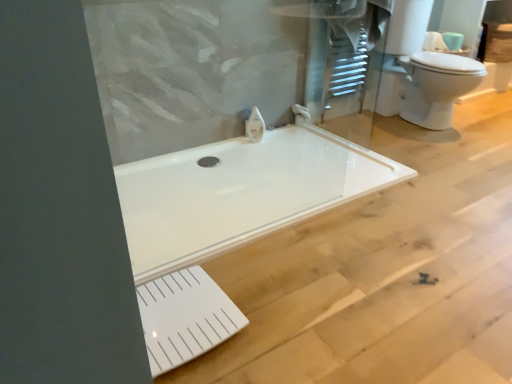
What do you see at coordinates (422, 71) in the screenshot?
I see `white glossy toilet at upper right` at bounding box center [422, 71].

This screenshot has height=384, width=512. What do you see at coordinates (301, 111) in the screenshot?
I see `white glossy faucet at upper center, which ranks as the 1th faucet in right-to-left order` at bounding box center [301, 111].

Identify the location of white glossy toilet at upper right. This screenshot has width=512, height=384. (422, 71).

In the image, is white matte toilet paper at upper right on the left side or the right side of white glossy faucet at upper center, which ranks as the 2th faucet in right-to-left order?

Based on their positions, white matte toilet paper at upper right is located to the right of white glossy faucet at upper center, which ranks as the 2th faucet in right-to-left order.

From a real-world perspective, is white matte toilet paper at upper right positioned over white glossy faucet at upper center, which ranks as the 2th faucet in right-to-left order, based on gravity?

Yes, from a real-world perspective, white matte toilet paper at upper right is over white glossy faucet at upper center, which ranks as the 2th faucet in right-to-left order

From the image's perspective, is white matte toilet paper at upper right beneath white glossy faucet at upper center, the first faucet in the left-to-right sequence?

Incorrect, from the image's perspective, white matte toilet paper at upper right is higher than white glossy faucet at upper center, the first faucet in the left-to-right sequence.

From a real-world perspective, relative to white glossy toilet at upper right, is white glossy faucet at upper center, the 2th faucet viewed from the front, vertically above or below?

white glossy faucet at upper center, the 2th faucet viewed from the front, is below white glossy toilet at upper right.

Is white glossy faucet at upper center, which ranks as the 1th faucet in right-to-left order, far away from white glossy toilet at upper right?

That's not correct — white glossy faucet at upper center, which ranks as the 1th faucet in right-to-left order, is a little close to white glossy toilet at upper right.

Between white glossy faucet at upper center, the second faucet viewed from the left, and white glossy toilet at upper right, which one has larger size?

white glossy toilet at upper right is bigger.

Is white glossy faucet at upper center, the 2th faucet viewed from the front, positioned in front of white glossy toilet at upper right?

That is False.

Which is more to the right, white glossy faucet at upper center, which ranks as the 2th faucet in right-to-left order, or white glossy faucet at upper center, arranged as the first faucet when viewed from the back?

white glossy faucet at upper center, arranged as the first faucet when viewed from the back, is more to the right.

From a real-world perspective, is white glossy faucet at upper center, which is the first faucet in front-to-back order, physically above white glossy faucet at upper center, arranged as the first faucet when viewed from the back?

Yes, from a real-world perspective, white glossy faucet at upper center, which is the first faucet in front-to-back order, is over white glossy faucet at upper center, arranged as the first faucet when viewed from the back

Who is smaller, white glossy faucet at upper center, the second faucet viewed from the left, or white matte toilet paper at upper right?

Smaller between the two is white glossy faucet at upper center, the second faucet viewed from the left.

Consider the image. Is white matte toilet paper at upper right a part of white glossy faucet at upper center, which ranks as the 1th faucet in right-to-left order?

No.

Between white glossy faucet at upper center, the second faucet viewed from the left, and white matte toilet paper at upper right, which one appears on the left side from the viewer's perspective?

white glossy faucet at upper center, the second faucet viewed from the left, is more to the left.

Is white glossy faucet at upper center, which ranks as the 1th faucet in right-to-left order, beside white matte toilet paper at upper right?

No.

From a real-world perspective, is white glossy faucet at upper center, which ranks as the 1th faucet in right-to-left order, under white glossy faucet at upper center, the first faucet in the left-to-right sequence?

Correct, in the physical world, white glossy faucet at upper center, which ranks as the 1th faucet in right-to-left order, is lower than white glossy faucet at upper center, the first faucet in the left-to-right sequence.

Is white glossy faucet at upper center, the second faucet viewed from the left, aimed at white glossy faucet at upper center, the first faucet in the left-to-right sequence?

No.

From the image's perspective, is white glossy faucet at upper center, which ranks as the 1th faucet in right-to-left order, located above white glossy faucet at upper center, which is the first faucet in front-to-back order?

Indeed, from the image's perspective, white glossy faucet at upper center, which ranks as the 1th faucet in right-to-left order, is shown above white glossy faucet at upper center, which is the first faucet in front-to-back order.

Looking at the image, does white glossy faucet at upper center, the 2th faucet viewed from the front, seem bigger or smaller compared to white glossy faucet at upper center, positioned as the second faucet in back-to-front order?

Clearly, white glossy faucet at upper center, the 2th faucet viewed from the front, is larger in size than white glossy faucet at upper center, positioned as the second faucet in back-to-front order.

Which of these two, white glossy faucet at upper center, which ranks as the 2th faucet in right-to-left order, or white glossy toilet at upper right, is thinner?

With smaller width is white glossy faucet at upper center, which ranks as the 2th faucet in right-to-left order.

Is white glossy faucet at upper center, the first faucet in the left-to-right sequence, turned away from white glossy toilet at upper right?

No, white glossy faucet at upper center, the first faucet in the left-to-right sequence, is not facing the opposite direction of white glossy toilet at upper right.

Is white glossy faucet at upper center, which ranks as the 2th faucet in right-to-left order, inside the boundaries of white glossy toilet at upper right, or outside?

white glossy faucet at upper center, which ranks as the 2th faucet in right-to-left order, is outside white glossy toilet at upper right.

Where is `sink above the white glossy faucet at upper center, the first faucet in the left-to-right sequence (from a real-world perspective)`? The image size is (512, 384). sink above the white glossy faucet at upper center, the first faucet in the left-to-right sequence (from a real-world perspective) is located at coordinates (422, 71).

Considering the positions of objects white matte toilet paper at upper right and white glossy faucet at upper center, the 2th faucet viewed from the front, in the image provided, who is behind, white matte toilet paper at upper right or white glossy faucet at upper center, the 2th faucet viewed from the front,?

white matte toilet paper at upper right is further from the camera.

Considering the positions of objects white matte toilet paper at upper right and white glossy faucet at upper center, the 2th faucet viewed from the front, in the image provided, who is more to the left, white matte toilet paper at upper right or white glossy faucet at upper center, the 2th faucet viewed from the front,?

Positioned to the left is white glossy faucet at upper center, the 2th faucet viewed from the front.

Does point (452, 44) lie in front of point (294, 108)?

That is False.

Would you say white matte toilet paper at upper right is outside white glossy faucet at upper center, the second faucet viewed from the left?

Yes.

Where is `toilet paper above the white glossy faucet at upper center, the first faucet in the left-to-right sequence (from a real-world perspective)`? toilet paper above the white glossy faucet at upper center, the first faucet in the left-to-right sequence (from a real-world perspective) is located at coordinates (453, 40).

In order to click on the 2nd faucet directly beneath the white glossy toilet at upper right (from a real-world perspective) in this screenshot , I will do `click(301, 111)`.

Based on the photo, looking at the image, which one is located closer to white glossy faucet at upper center, positioned as the second faucet in back-to-front order, white glossy toilet at upper right or white matte toilet paper at upper right?

white glossy toilet at upper right lies closer to white glossy faucet at upper center, positioned as the second faucet in back-to-front order, than the other object.

Estimate the real-world distances between objects in this image. Which object is closer to white glossy faucet at upper center, arranged as the first faucet when viewed from the back, white glossy faucet at upper center, which is the first faucet in front-to-back order, or white matte toilet paper at upper right?

white glossy faucet at upper center, which is the first faucet in front-to-back order.

Which object lies nearer to the anchor point white matte toilet paper at upper right, white glossy faucet at upper center, which ranks as the 1th faucet in right-to-left order, or white glossy faucet at upper center, which is the first faucet in front-to-back order?

The object closer to white matte toilet paper at upper right is white glossy faucet at upper center, which ranks as the 1th faucet in right-to-left order.

When comparing their distances from white glossy faucet at upper center, the second faucet viewed from the left, does white matte toilet paper at upper right or white glossy toilet at upper right seem further?

The object further to white glossy faucet at upper center, the second faucet viewed from the left, is white matte toilet paper at upper right.

Looking at the image, which one is located closer to white glossy faucet at upper center, positioned as the second faucet in back-to-front order, white matte toilet paper at upper right or white glossy faucet at upper center, the second faucet viewed from the left?

white glossy faucet at upper center, the second faucet viewed from the left.

Based on their spatial positions, is white glossy toilet at upper right or white glossy faucet at upper center, which is the first faucet in front-to-back order, further from white matte toilet paper at upper right?

white glossy faucet at upper center, which is the first faucet in front-to-back order, is further to white matte toilet paper at upper right.

Looking at the image, which one is located closer to white glossy toilet at upper right, white glossy faucet at upper center, arranged as the first faucet when viewed from the back, or white matte toilet paper at upper right?

Based on the image, white matte toilet paper at upper right appears to be nearer to white glossy toilet at upper right.

When comparing their distances from white matte toilet paper at upper right, does white glossy toilet at upper right or white glossy faucet at upper center, the second faucet viewed from the left, seem further?

white glossy faucet at upper center, the second faucet viewed from the left, is positioned further to the anchor white matte toilet paper at upper right.

At what (x,y) coordinates should I click in order to perform the action: click on faucet between white glossy faucet at upper center, which ranks as the 2th faucet in right-to-left order, and white glossy toilet at upper right. Please return your answer as a coordinate pair (x, y). Looking at the image, I should click on (301, 111).

I want to click on sink located between white glossy faucet at upper center, arranged as the first faucet when viewed from the back, and white matte toilet paper at upper right in the left-right direction, so click(422, 71).

Where is `sink between white glossy faucet at upper center, positioned as the second faucet in back-to-front order, and white matte toilet paper at upper right`? The width and height of the screenshot is (512, 384). sink between white glossy faucet at upper center, positioned as the second faucet in back-to-front order, and white matte toilet paper at upper right is located at coordinates (422, 71).

Where is `faucet between white glossy faucet at upper center, positioned as the second faucet in back-to-front order, and white matte toilet paper at upper right from left to right`? The width and height of the screenshot is (512, 384). faucet between white glossy faucet at upper center, positioned as the second faucet in back-to-front order, and white matte toilet paper at upper right from left to right is located at coordinates (301, 111).